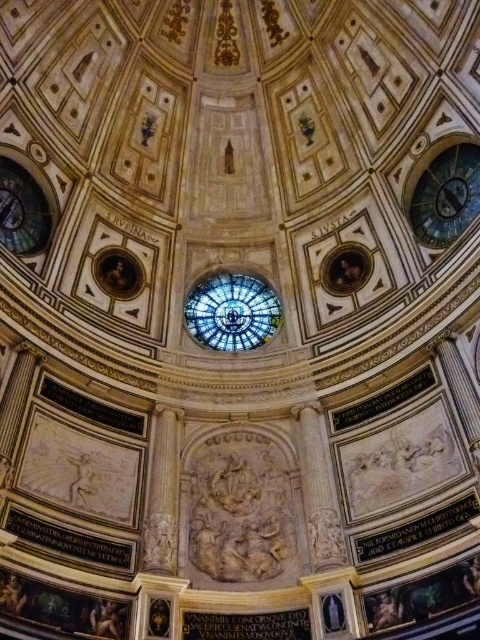
Is stained glass dome at center further to the viewer compared to blue glass clock at upper right?

Yes.

From the picture: Can you confirm if stained glass dome at center is bigger than blue glass clock at upper right?

Indeed, stained glass dome at center has a larger size compared to blue glass clock at upper right.

What do you see at coordinates (231, 310) in the screenshot? I see `stained glass dome at center` at bounding box center [231, 310].

Find the location of a particular element. stained glass dome at center is located at coordinates (231, 310).

Does blue glass clock at upper right appear on the right side of white marble column at center?

Correct, you'll find blue glass clock at upper right to the right of white marble column at center.

Who is more forward, (467, 177) or (168, 422)?

Point (168, 422) is more forward.

Is point (424, 241) farther from camera compared to point (167, 451)?

That is True.

I want to click on blue glass clock at upper right, so click(446, 195).

Can you confirm if stained glass dome at center is positioned above white marble column at center?

Correct, stained glass dome at center is located above white marble column at center.

Does point (272, 291) lie in front of point (152, 458)?

No, it is behind (152, 458).

The width and height of the screenshot is (480, 640). In order to click on stained glass dome at center in this screenshot , I will do `click(231, 310)`.